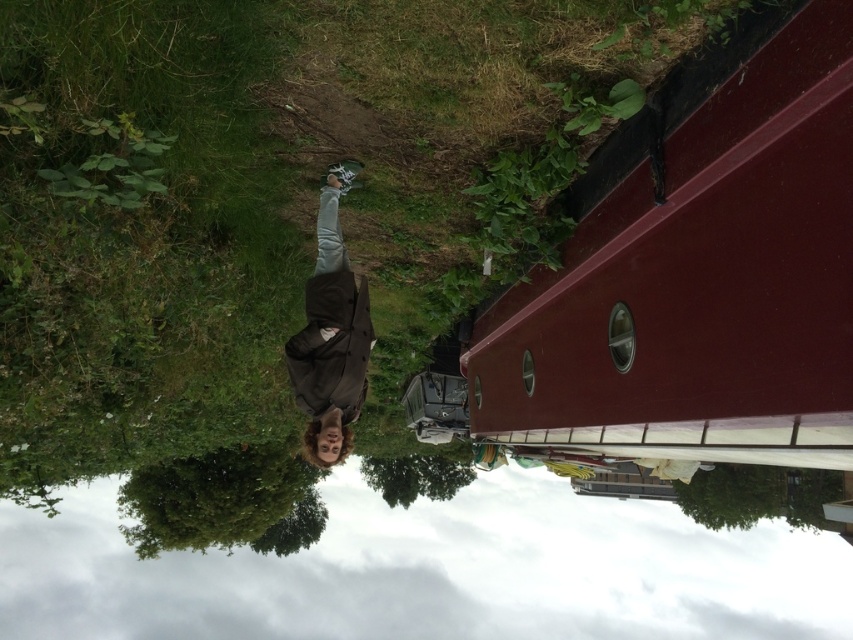
Which is behind, point (708, 128) or point (170, 557)?

The point (170, 557) is more distant.

Does maroon smooth boat at upper right have a smaller size compared to transparent plastic water at lower center?

Yes.

Which is behind, point (653, 259) or point (546, 602)?

The point (546, 602) is more distant.

Identify the location of maroon smooth boat at upper right. The width and height of the screenshot is (853, 640). (700, 284).

Can you confirm if transparent plastic water at lower center is positioned below brown fabric jacket at center?

Indeed, transparent plastic water at lower center is positioned under brown fabric jacket at center.

What are the coordinates of `transparent plastic water at lower center` in the screenshot? It's located at (428, 572).

Is maroon smooth boat at upper right to the left of brown fabric jacket at center from the viewer's perspective?

In fact, maroon smooth boat at upper right is to the right of brown fabric jacket at center.

Is maroon smooth boat at upper right shorter than brown fabric jacket at center?

No.

Is point (492, 394) positioned in front of point (323, 346)?

No, (492, 394) is further to viewer.

Find the location of a particular element. The width and height of the screenshot is (853, 640). maroon smooth boat at upper right is located at coordinates (700, 284).